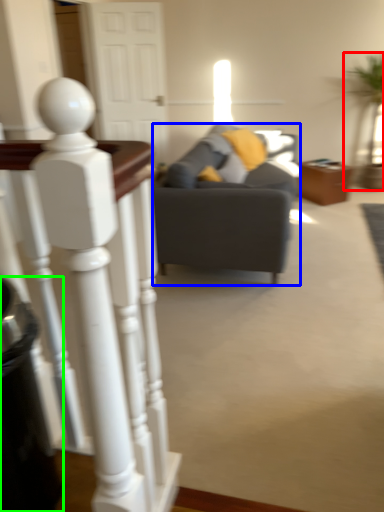
Question: Which object is the closest to the houseplant (highlighted by a red box)? Choose among these: studio couch (highlighted by a blue box) or trash bin/can (highlighted by a green box).

Choices:
 (A) studio couch
 (B) trash bin/can

Answer: (A)